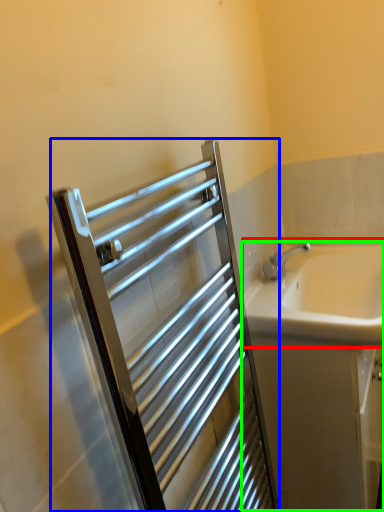
Question: Considering the real-world distances, which object is closest to sink (highlighted by a red box)? screen door (highlighted by a blue box) or bath (highlighted by a green box).

Choices:
 (A) screen door
 (B) bath

Answer: (B)